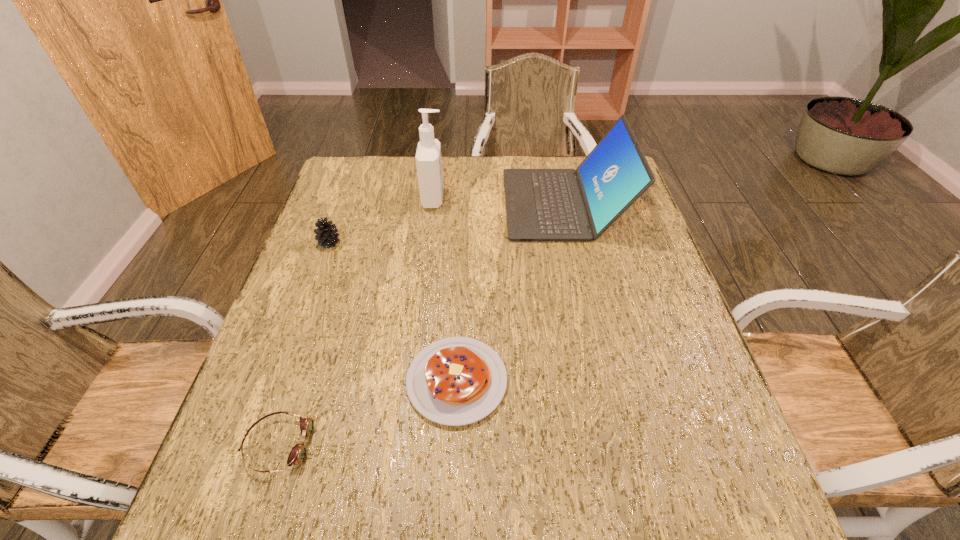
In the image, there is a desktop. Where is `free space at the near edge`? This screenshot has width=960, height=540. free space at the near edge is located at coordinates (635, 510).

At what (x,y) coordinates should I click in order to perform the action: click on vacant space at the left edge of the desktop. Please return your answer as a coordinate pair (x, y). The image size is (960, 540). Looking at the image, I should click on 317,294.

Where is `vacant space at the right edge of the desktop`? The width and height of the screenshot is (960, 540). vacant space at the right edge of the desktop is located at coordinates (711, 383).

This screenshot has width=960, height=540. I want to click on vacant space at the far left corner of the desktop, so click(343, 180).

This screenshot has width=960, height=540. I want to click on vacant region at the near left corner of the desktop, so click(212, 495).

At what (x,y) coordinates should I click in order to perform the action: click on free space that is in between the third tallest object and the laptop computer. Please return your answer as a coordinate pair (x, y). The height and width of the screenshot is (540, 960). Looking at the image, I should click on (446, 223).

This screenshot has height=540, width=960. Identify the location of unoccupied area between the tallest object and the third tallest object. (382, 221).

Where is `empty space between the cleansing agent and the pancake`? Image resolution: width=960 pixels, height=540 pixels. empty space between the cleansing agent and the pancake is located at coordinates (445, 290).

The image size is (960, 540). Identify the location of vacant space that's between the goggles and the rightmost object. [421, 325].

The height and width of the screenshot is (540, 960). I want to click on free point between the pinecone and the tallest object, so click(382, 221).